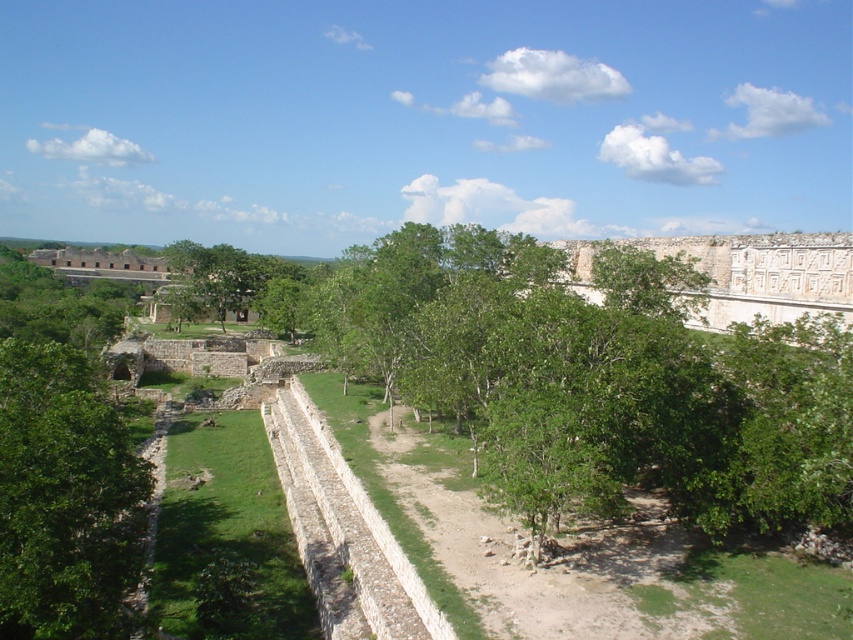
You are an archaeologist standing at the entrance of the archaeological site. You notice the white stone wall at upper right and the green leafy tree at center. Which object takes up more area in the image?

The green leafy tree at center occupies more space than the white stone wall at upper right according to the description.